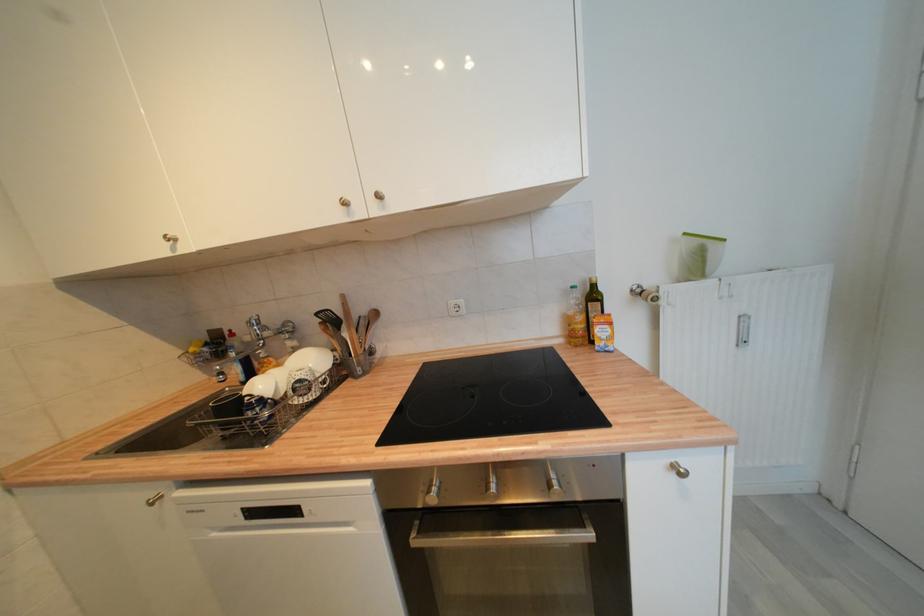
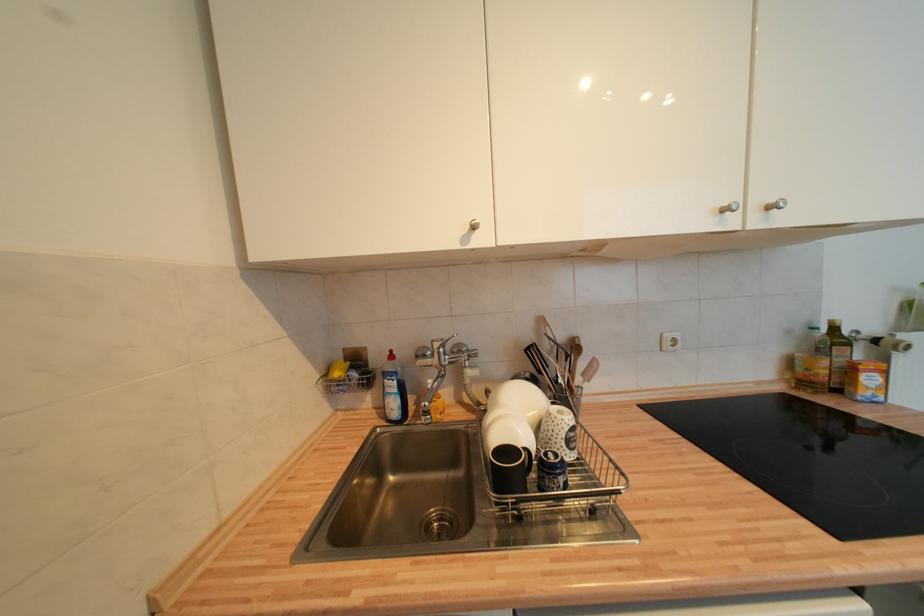
Question: What movement of the cameraman would produce the second image?

Choices:
 (A) Left
 (B) Right
 (C) Forward
 (D) Backward

Answer: (A)